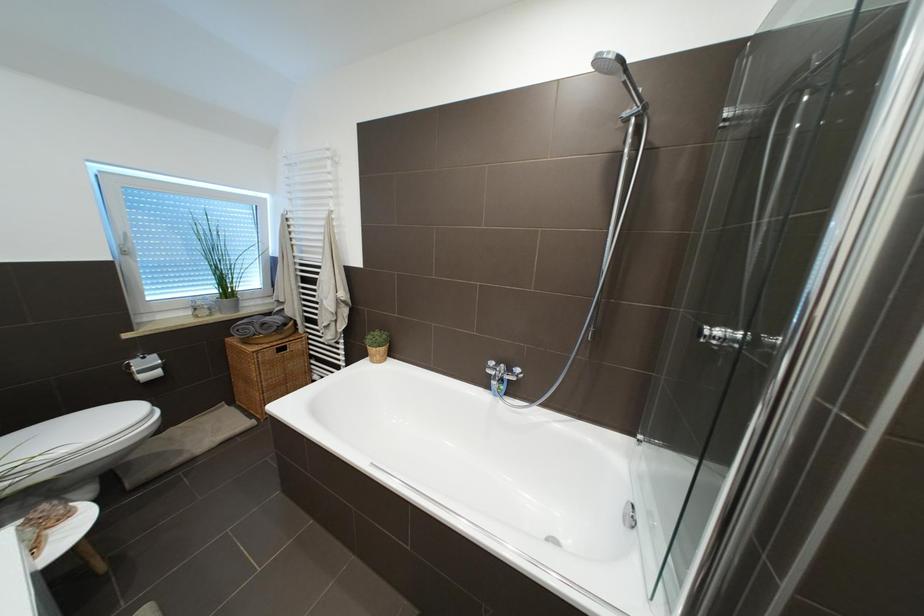
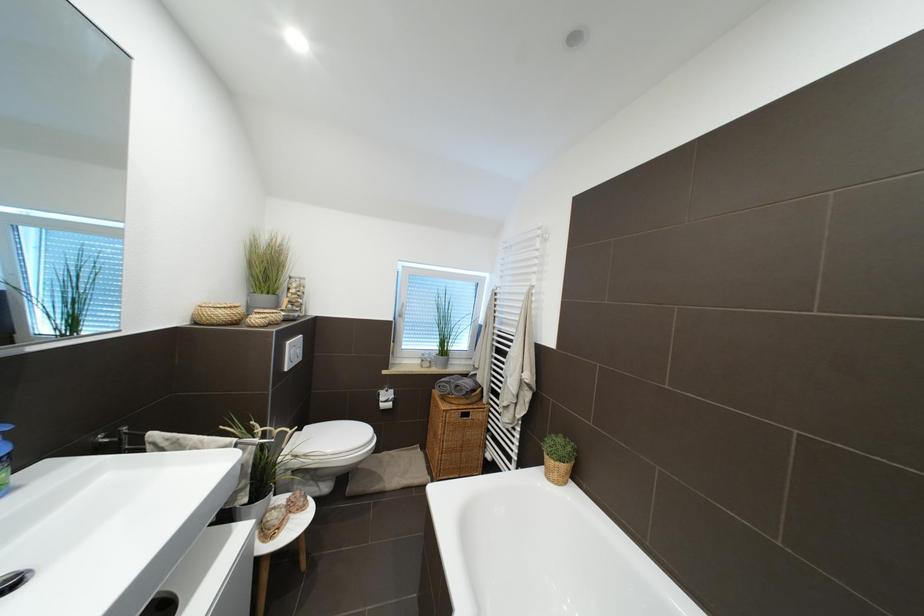
Question: The camera is either moving clockwise (left) or counter-clockwise (right) around the object. The first image is from the beginning of the video and the second image is from the end. Is the camera moving left or right when shooting the video?

Choices:
 (A) Left
 (B) Right

Answer: (B)